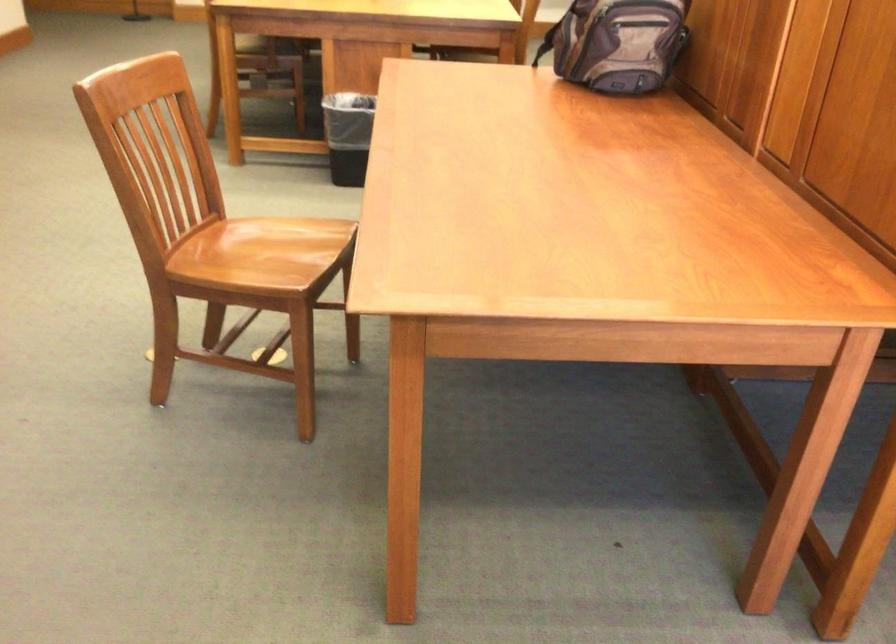
This screenshot has height=644, width=896. What do you see at coordinates (262, 240) in the screenshot?
I see `the chair sitting surface` at bounding box center [262, 240].